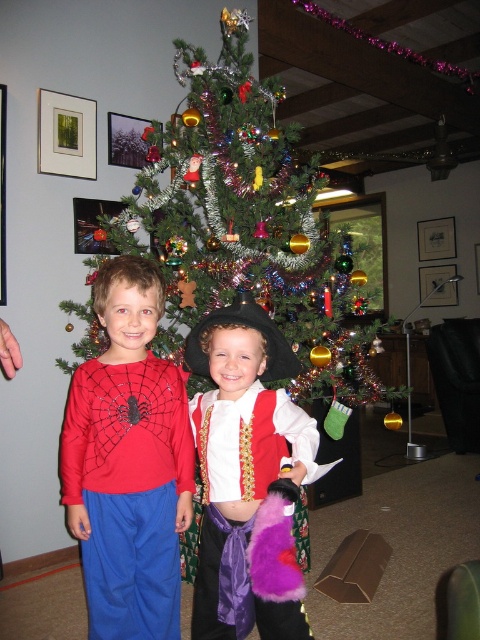
Is point (264, 401) positioned after point (108, 157)?

No.

Does purple satin vest at center lie in front of metallic silver picture frame at upper left?

That is True.

Does point (238, 458) lie behind point (120, 138)?

No, it is in front of (120, 138).

This screenshot has width=480, height=640. I want to click on purple satin vest at center, so click(239, 476).

Which is below, purple satin vest at center or metallic reflective ornament at center?

purple satin vest at center is lower down.

Between purple satin vest at center and metallic reflective ornament at center, which one appears on the left side from the viewer's perspective?

metallic reflective ornament at center is more to the left.

Find the location of `purple satin vest at center`. purple satin vest at center is located at coordinates (239, 476).

Describe the element at coordinates (67, 134) in the screenshot. This screenshot has height=640, width=480. I see `green matte picture frame at upper left` at that location.

Which is above, green matte picture frame at upper left or metallic silver picture frame at upper left?

metallic silver picture frame at upper left

Who is more distant from viewer, (73, 164) or (110, 131)?

Positioned behind is point (110, 131).

Locate an element on the screen. The height and width of the screenshot is (640, 480). green matte picture frame at upper left is located at coordinates tap(67, 134).